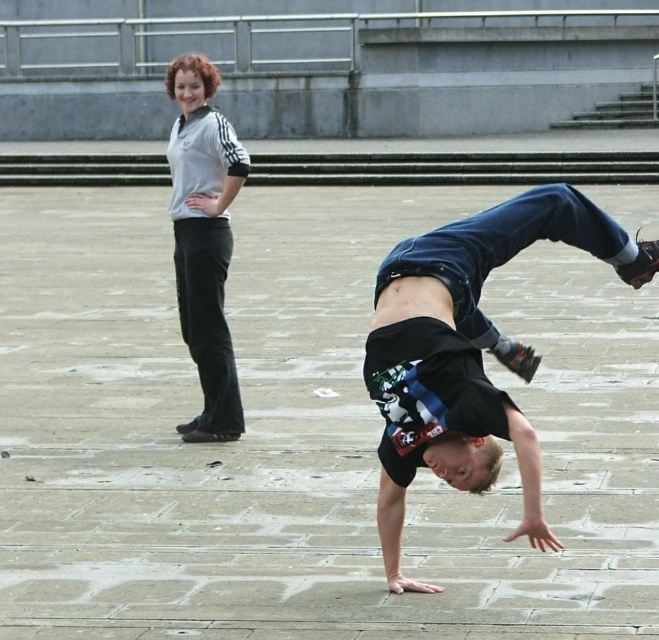
Who is shorter, black cotton shirt at center or white matte pants at upper left?

With less height is black cotton shirt at center.

Who is more forward, (529,200) or (221,420)?

Point (529,200) is more forward.

Identify the location of black cotton shirt at center. (467, 355).

You are a GUI agent. You are given a task and a screenshot of the screen. Output one action in this format:
    pyautogui.click(x=<x>, y=<y>)
    Task: Click on the black cotton shirt at center
    The width and height of the screenshot is (659, 640).
    Given the screenshot: What is the action you would take?
    pyautogui.click(x=467, y=355)